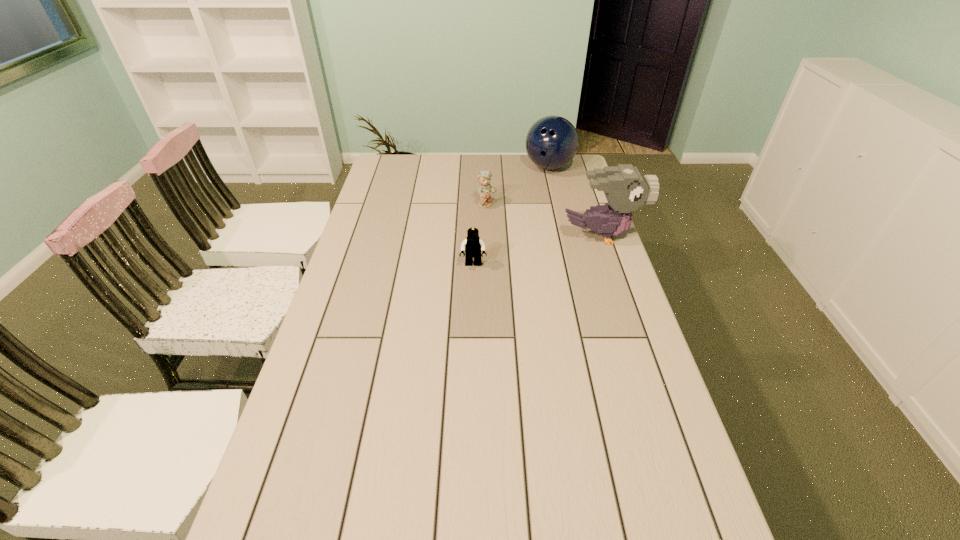
The width and height of the screenshot is (960, 540). I want to click on free space that satisfies the following two spatial constraints: 1. on the front side of the third farthest object; 2. at the beak of the third nearest object, so click(x=488, y=236).

The height and width of the screenshot is (540, 960). I want to click on vacant region that satisfies the following two spatial constraints: 1. on the front side of the teddy bear; 2. at the beak of the bird, so click(x=488, y=236).